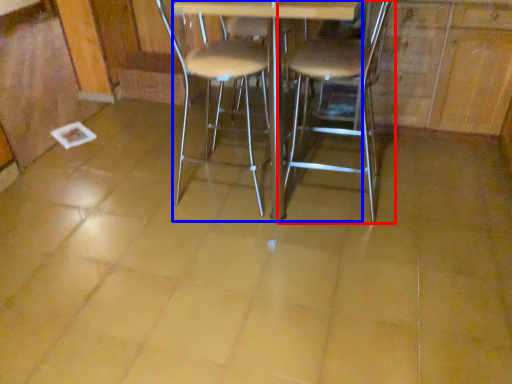
Question: Which of the following is the farthest to the observer, chair (highlighted by a red box) or round table (highlighted by a blue box)?

Choices:
 (A) chair
 (B) round table

Answer: (A)